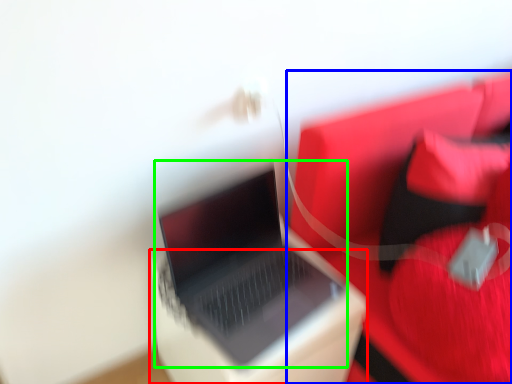
Question: Which object is the farthest from cardboard box (highlighted by a red box)? Choose among these: furniture (highlighted by a blue box) or laptop (highlighted by a green box).

Choices:
 (A) furniture
 (B) laptop

Answer: (A)